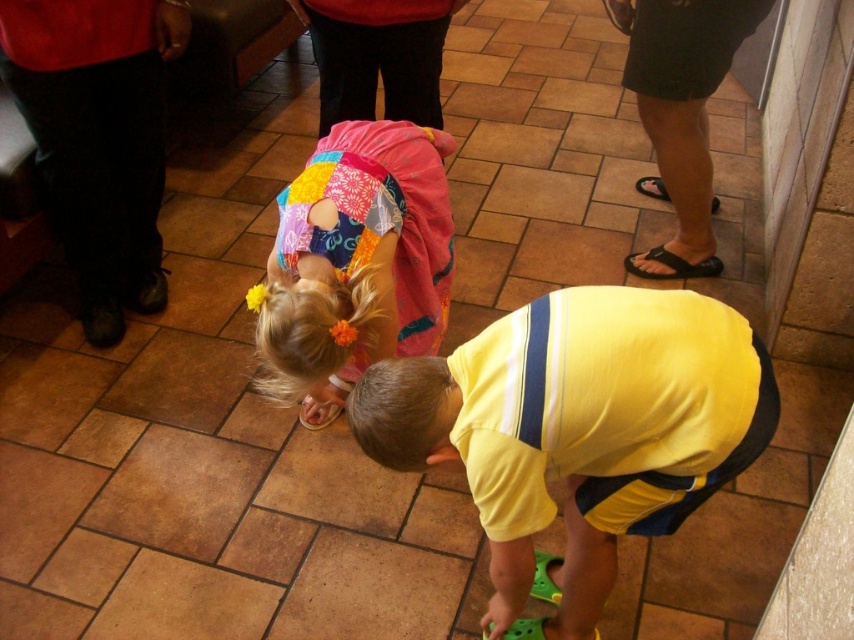
You are a photographer setting up a camera on a tripod. The camera needs to capture both the yellow cotton shirt at lower center and the patchwork fabric dress at center without any obstruction. Based on their positions, which object should you ensure is closer to the camera to avoid being cut off?

The yellow cotton shirt at lower center might be wider than the patchwork fabric dress at center, so positioning the yellow cotton shirt at lower center closer to the camera would help ensure it fits within the frame without being cut off.

You are standing in the middle of the room and see two points marked on the floor. The first point is at coordinate point(633, 497) and the second is at point(329, 228). Which point is closer to you?

Point(633, 497) is closer to the viewer than point(329, 228).

You are standing at the entrance of the room and want to find the yellow cotton shirt at lower center. According to the coordinates provided, in which direction should you look to locate it?

The yellow cotton shirt at lower center is located at coordinates point (578,429), which means you should look towards the lower center direction to find it.